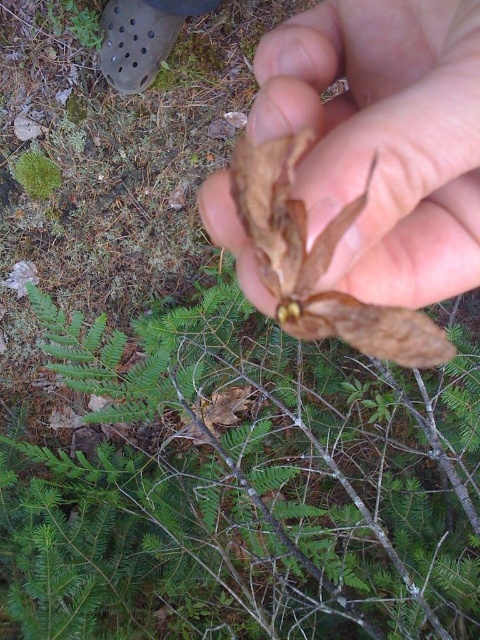
You are a botanist examining a seed pod in a forest. You notice a brown matte leaf at upper center and a green fuzzy moss at upper left. Which of these two items is bigger in size?

The brown matte leaf at upper center is larger in size than the green fuzzy moss at upper left.